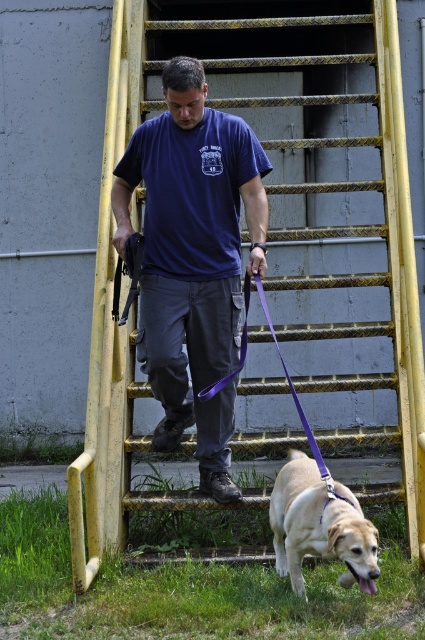
You are a delivery person who needs to reach the golden fur dog at lower center. There is a yellow metallic ladder at center in your way. Which direction should you move to avoid the ladder and reach the dog?

Since the yellow metallic ladder at center is to the left of the golden fur dog at lower center, you should move to the right to avoid the ladder and reach the dog.